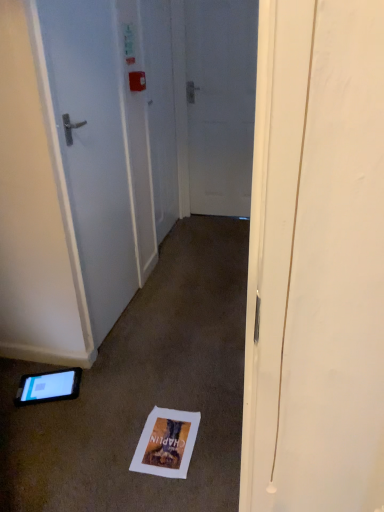
Where is `free space in front of white glossy door at left, marked as the 1th door in a front-to-back arrangement`? free space in front of white glossy door at left, marked as the 1th door in a front-to-back arrangement is located at coordinates pos(127,358).